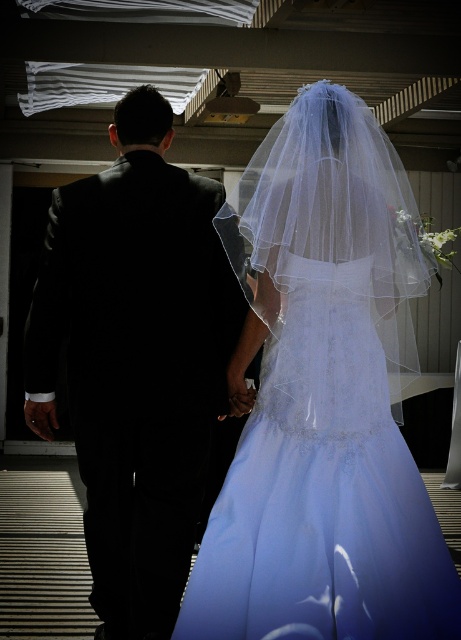
As a photographer capturing the wedding scene, you need to ensure both the translucent white veil at upper center and the black satin suit at left are in focus. Given their positions, which object is wider and requires a larger depth of field to capture fully?

The translucent white veil at upper center might be wider than the black satin suit at left, so it requires a larger depth of field to capture fully.

You are a photographer at the wedding and want to capture a photo where both the translucent white veil at upper center and the black satin suit at left are clearly visible. Which object should you adjust your camera focus on first to ensure both are in frame?

The translucent white veil at upper center is positioned on the right side of the black satin suit at left. To ensure both are in frame, focus on the black satin suit at left first, then adjust to include the veil on its right side.

You are a photographer at the wedding. You need to capture a closeup shot of both the translucent white veil at upper center and the black satin suit at left. Since your camera can only focus on one object at a time, which object should you prioritize to ensure it fits entirely within the frame?

The translucent white veil at upper center is bigger than the black satin suit at left, so you should prioritize capturing the translucent white veil at upper center to ensure it fits entirely within the frame.